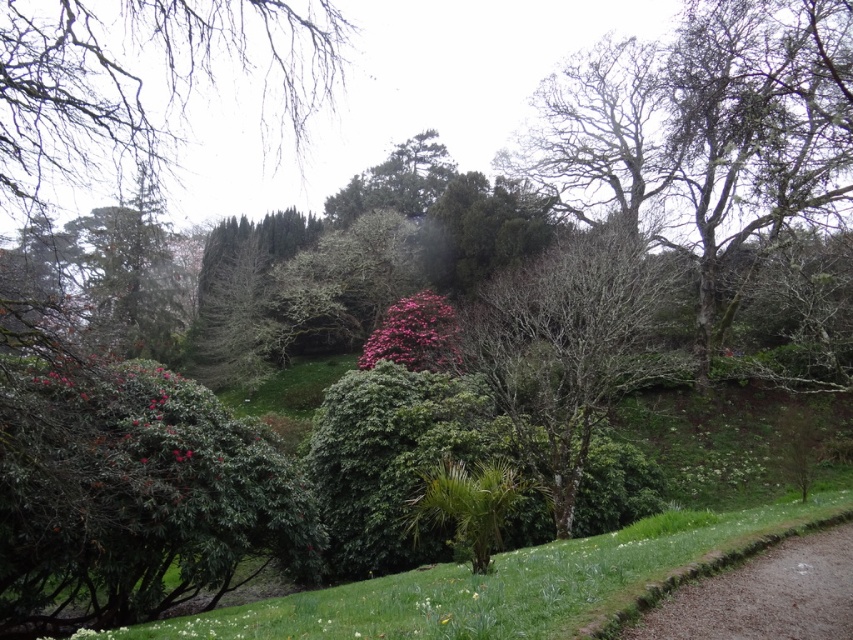
You are a gardener who needs to water both the green leafy bush at lower left and the pink matte flower at center. Based on their positions, which one do you think is closer to the ground?

The green leafy bush at lower left is closer to the ground since it is positioned below the pink matte flower at center.

You are a gardener standing at the entrance of the garden and want to reach both the green leafy bush at lower left and the bare branches at upper left. Which one should you approach first to reach the closer one?

You should approach the green leafy bush at lower left first because it is closer to you than the bare branches at upper left.